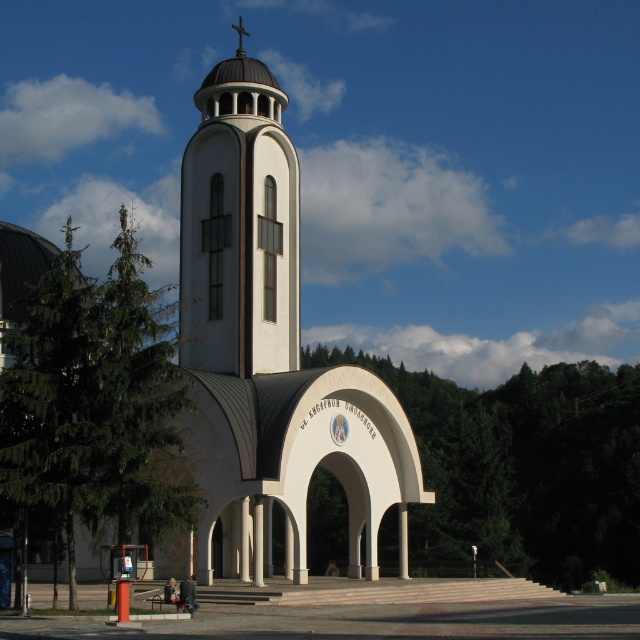
You are a visitor standing in front of the building and want to take a photo that includes both the white smooth tower at center and the white smooth pillar at center. Which object will appear larger in the photo?

The white smooth tower at center will appear larger in the photo because it is much taller than the white smooth pillar at center.

You are a construction worker planning to install a new lighting system on the white smooth tower at center and the white smooth pillar at center. You need to run a cable from the tower to the pillar. What is the minimum length of cable you need to connect them?

The distance between the white smooth tower at center and the white smooth pillar at center is 15.97 meters, so the minimum length of cable needed is 15.97 meters.

You are a maintenance worker needing to replace a damaged pillar. You have a tool that can reach 1.8 meters. Can you reach both the white marble pillar at center and the white smooth pillar at center from your current position without moving the tool?

The white marble pillar at center is 1.82 meters from the white smooth pillar at center. Since the tool can only reach 1.8 meters, the distance between them is slightly longer than the tool can cover. Therefore, you cannot reach both pillars without moving the tool.